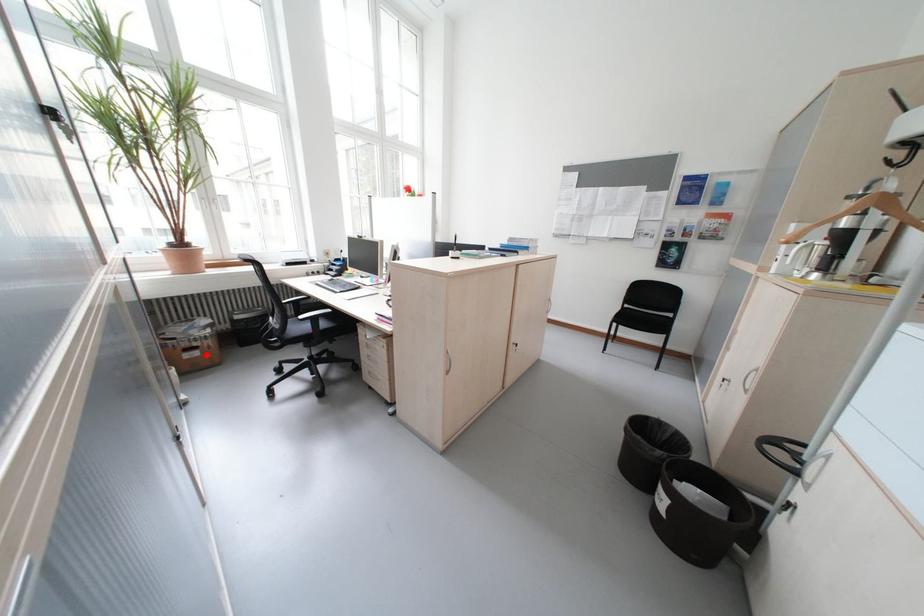
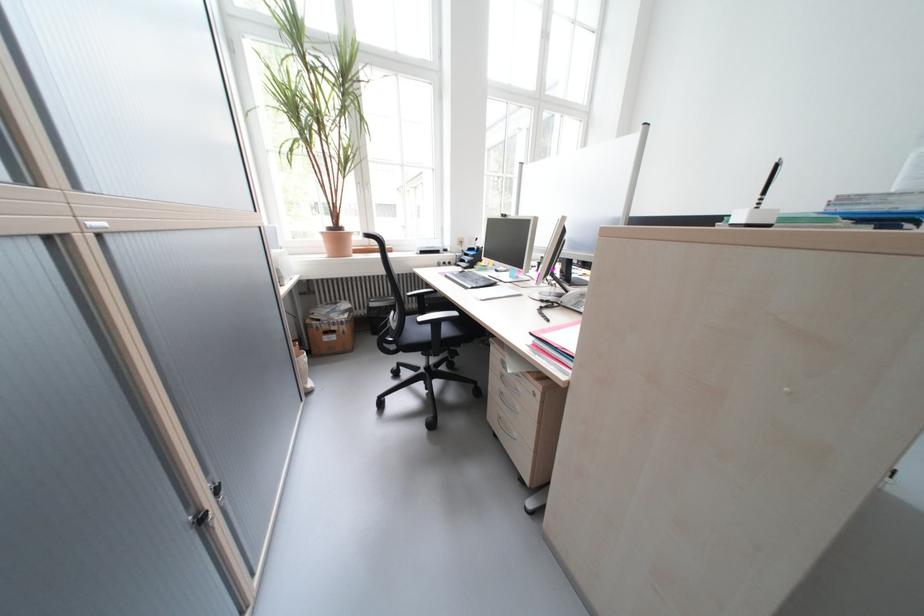
Question: I am providing you with two images of the same scene from different viewpoints. Image1 has a red point marked. In image2, the corresponding 3D location appears at what relative position? Reply with the corresponding letter.

Choices:
 (A) Closer
 (B) Farther

Answer: (A)